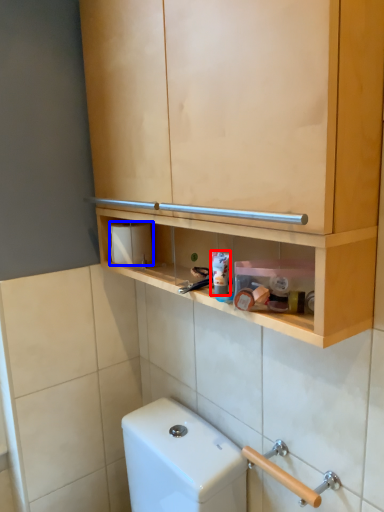
Question: Which object appears closest to the camera in this image, toothpaste (highlighted by a red box) or toilet paper (highlighted by a blue box)?

Choices:
 (A) toothpaste
 (B) toilet paper

Answer: (A)